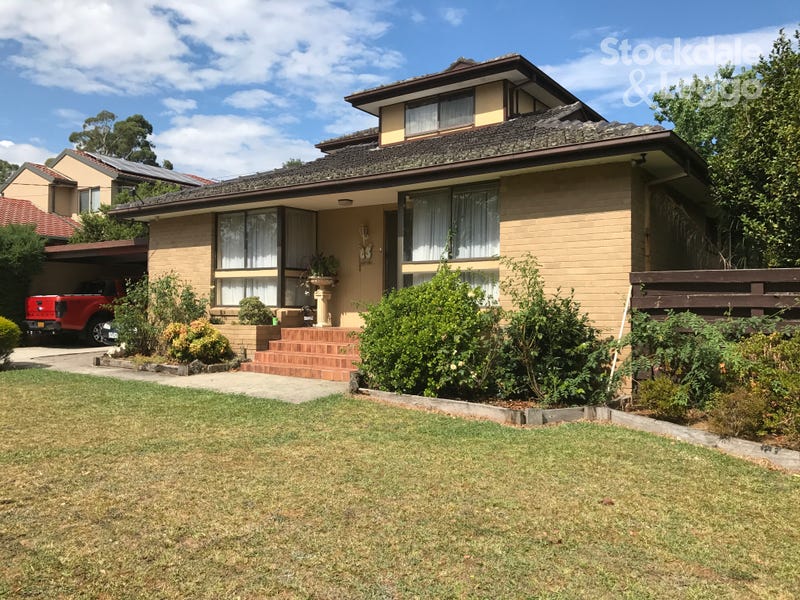
The height and width of the screenshot is (600, 800). Find the location of `window`. window is located at coordinates (438, 232).